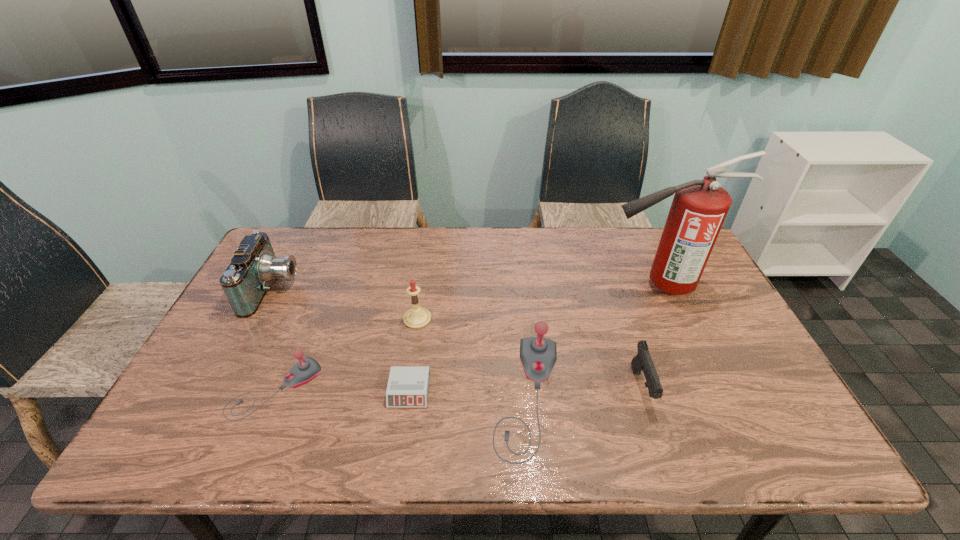
Where is `the left joystick`? the left joystick is located at coordinates (304, 371).

Locate an element on the screen. This screenshot has width=960, height=540. the shorter joystick is located at coordinates (304, 371).

At what (x,y) coordinates should I click in order to perform the action: click on the right joystick. Please return your answer as a coordinate pair (x, y). The image size is (960, 540). Looking at the image, I should click on (538, 355).

Where is `the third object from right to left`? The height and width of the screenshot is (540, 960). the third object from right to left is located at coordinates (538, 355).

The height and width of the screenshot is (540, 960). What are the coordinates of `candle` in the screenshot? It's located at (417, 317).

Locate an element on the screen. The width and height of the screenshot is (960, 540). camcorder is located at coordinates (254, 266).

Where is `the tallest object`? The height and width of the screenshot is (540, 960). the tallest object is located at coordinates (699, 207).

Where is `pistol`? pistol is located at coordinates (642, 361).

Find the location of `the shortest object`. the shortest object is located at coordinates (408, 386).

This screenshot has width=960, height=540. Identify the location of vacant space located 0.270m on the back of the left joystick. (316, 291).